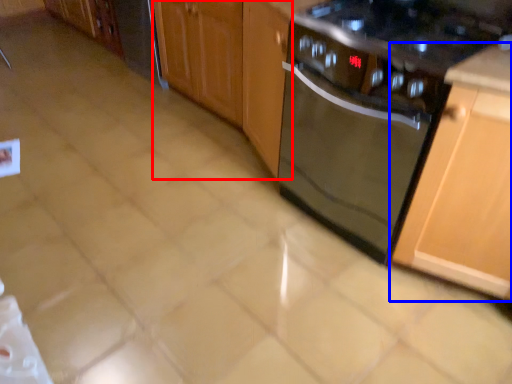
Question: Which point is further to the camera, cabinetry (highlighted by a red box) or cabinetry (highlighted by a blue box)?

Choices:
 (A) cabinetry
 (B) cabinetry

Answer: (A)